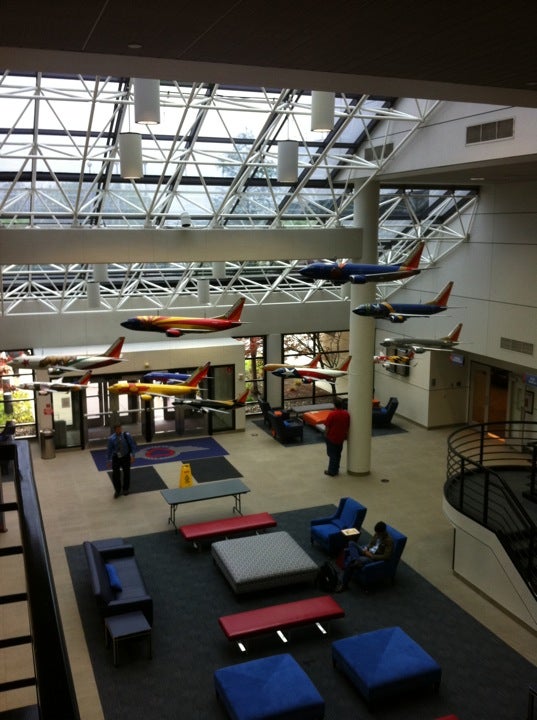
At what (x,y) coordinates should I click in order to perform the action: click on carpet. Please return your answer as a coordinate pair (x, y). The image size is (537, 720). Looking at the image, I should click on [x=148, y=482], [x=216, y=468], [x=198, y=444].